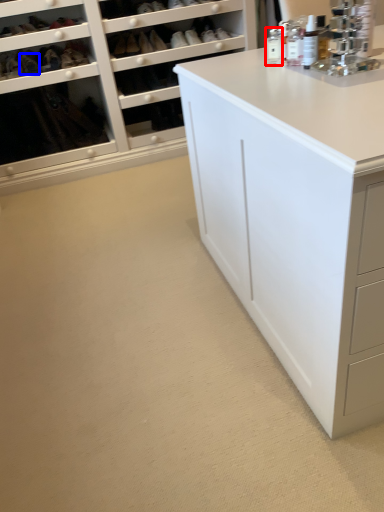
Question: Which of the following is the closest to the observer, toiletry (highlighted by a red box) or shoe (highlighted by a blue box)?

Choices:
 (A) toiletry
 (B) shoe

Answer: (A)